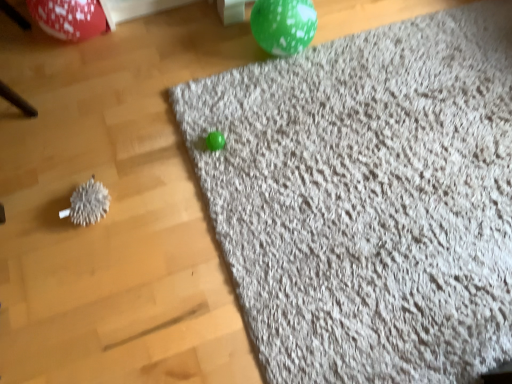
Question: Considering the relative sizes of gray shaggy rug at upper right and shiny red balloon at upper left, which is counted as the first balloon, starting from the left, in the image provided, is gray shaggy rug at upper right smaller than shiny red balloon at upper left, which is counted as the first balloon, starting from the left,?

Choices:
 (A) yes
 (B) no

Answer: (B)

Question: Is gray shaggy rug at upper right bigger than shiny red balloon at upper left, which is counted as the first balloon, starting from the left?

Choices:
 (A) yes
 (B) no

Answer: (A)

Question: Can you confirm if gray shaggy rug at upper right is taller than shiny red balloon at upper left, marked as the second balloon in a right-to-left arrangement?

Choices:
 (A) yes
 (B) no

Answer: (B)

Question: From a real-world perspective, is gray shaggy rug at upper right on top of shiny red balloon at upper left, marked as the second balloon in a right-to-left arrangement?

Choices:
 (A) yes
 (B) no

Answer: (B)

Question: Does gray shaggy rug at upper right have a lesser width compared to shiny red balloon at upper left, marked as the second balloon in a right-to-left arrangement?

Choices:
 (A) no
 (B) yes

Answer: (A)

Question: Are gray shaggy rug at upper right and shiny red balloon at upper left, which is counted as the first balloon, starting from the left, far apart?

Choices:
 (A) no
 (B) yes

Answer: (A)

Question: Is shiny red balloon at upper left, marked as the second balloon in a right-to-left arrangement, with green speckled balloon at upper center, marked as the first balloon in a right-to-left arrangement?

Choices:
 (A) no
 (B) yes

Answer: (A)

Question: Considering the relative sizes of shiny red balloon at upper left, which is counted as the first balloon, starting from the left, and green speckled balloon at upper center, marked as the first balloon in a right-to-left arrangement, in the image provided, is shiny red balloon at upper left, which is counted as the first balloon, starting from the left, smaller than green speckled balloon at upper center, marked as the first balloon in a right-to-left arrangement,?

Choices:
 (A) no
 (B) yes

Answer: (A)

Question: Does shiny red balloon at upper left, marked as the second balloon in a right-to-left arrangement, have a greater height compared to green speckled balloon at upper center, which appears as the second balloon when viewed from the left?

Choices:
 (A) yes
 (B) no

Answer: (A)

Question: Considering the relative sizes of shiny red balloon at upper left, which is counted as the first balloon, starting from the left, and green speckled balloon at upper center, which appears as the second balloon when viewed from the left, in the image provided, is shiny red balloon at upper left, which is counted as the first balloon, starting from the left, thinner than green speckled balloon at upper center, which appears as the second balloon when viewed from the left,?

Choices:
 (A) yes
 (B) no

Answer: (A)

Question: Does shiny red balloon at upper left, which is counted as the first balloon, starting from the left, come behind green speckled balloon at upper center, marked as the first balloon in a right-to-left arrangement?

Choices:
 (A) yes
 (B) no

Answer: (A)

Question: Considering the relative positions of shiny red balloon at upper left, marked as the second balloon in a right-to-left arrangement, and green speckled balloon at upper center, marked as the first balloon in a right-to-left arrangement, in the image provided, is shiny red balloon at upper left, marked as the second balloon in a right-to-left arrangement, to the right of green speckled balloon at upper center, marked as the first balloon in a right-to-left arrangement, from the viewer's perspective?

Choices:
 (A) yes
 (B) no

Answer: (B)

Question: Is white fuzzy ball at left far away from green speckled balloon at upper center, which appears as the second balloon when viewed from the left?

Choices:
 (A) no
 (B) yes

Answer: (A)